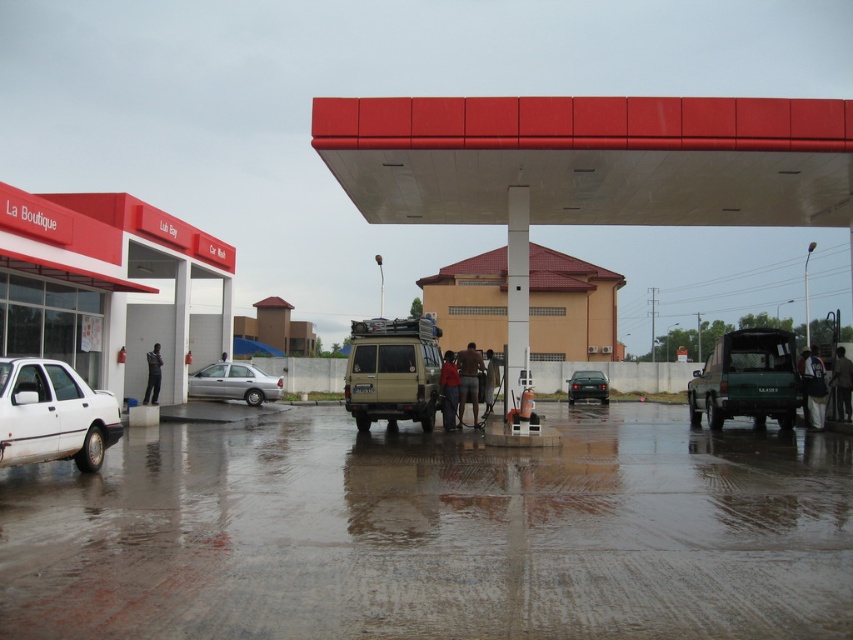
Question: Among these points, which one is farthest from the camera?

Choices:
 (A) (68, 428)
 (B) (399, 372)
 (C) (585, 372)

Answer: (C)

Question: Is matte beige jeep at center further to camera compared to satin silver sedan at center?

Choices:
 (A) yes
 (B) no

Answer: (B)

Question: Which of the following is the farthest from the observer?

Choices:
 (A) dark green matte car at center
 (B) satin silver sedan at center
 (C) white matte car at lower left

Answer: (A)

Question: Does satin silver sedan at center have a smaller size compared to black fabric person at center?

Choices:
 (A) yes
 (B) no

Answer: (B)

Question: Which object is farther from the camera taking this photo?

Choices:
 (A) brown fabric shirt at lower right
 (B) red fabric shirt at center
 (C) black fabric person at center

Answer: (C)

Question: Does metallic silver van at center come behind brown textured shorts at center?

Choices:
 (A) no
 (B) yes

Answer: (A)